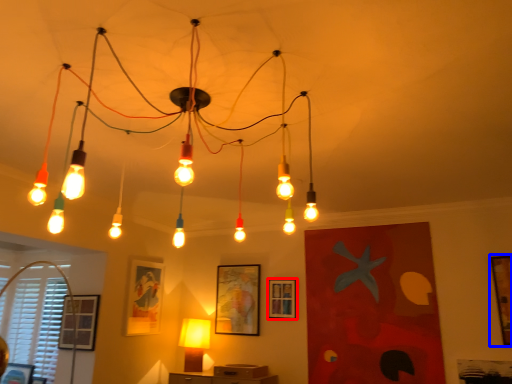
Question: Which point is closer to the camera, picture frame (highlighted by a red box) or picture frame (highlighted by a blue box)?

Choices:
 (A) picture frame
 (B) picture frame

Answer: (B)